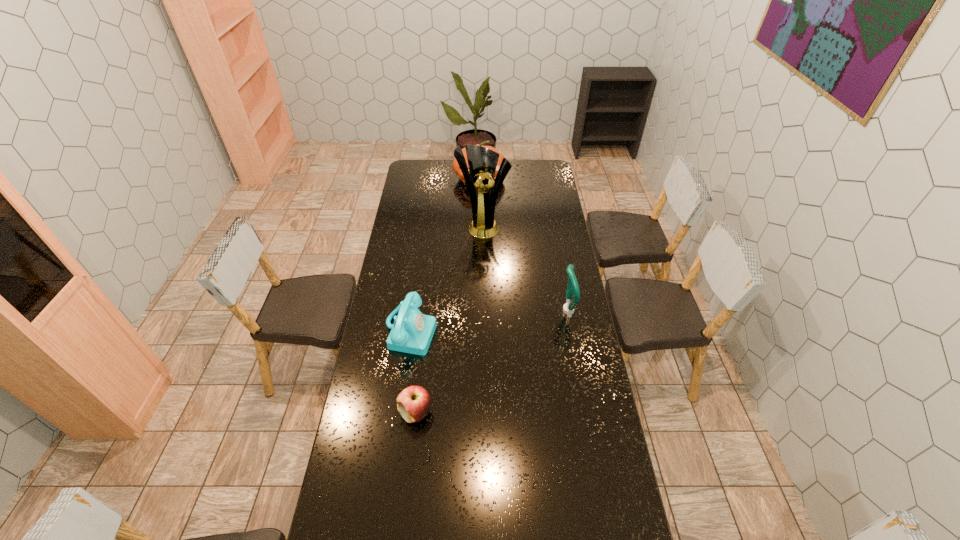
This screenshot has width=960, height=540. What are the coordinates of `vacant space located 0.080m on the front face of the pumpkin` in the screenshot? It's located at [484, 201].

At what (x,y) coordinates should I click in order to perform the action: click on vacant position located on the front face of the pumpkin. Please return your answer as a coordinate pair (x, y). Looking at the image, I should click on (486, 215).

Find the location of a particular element. The width and height of the screenshot is (960, 540). object that is at the far edge is located at coordinates (455, 165).

The height and width of the screenshot is (540, 960). What are the coordinates of `apple positioned at the left edge` in the screenshot? It's located at (413, 403).

The image size is (960, 540). I want to click on telephone that is at the left edge, so click(412, 332).

Identify the location of object present at the right edge. (572, 287).

Where is `vacant region at the near edge of the desktop`? The width and height of the screenshot is (960, 540). vacant region at the near edge of the desktop is located at coordinates (510, 503).

Where is `free space at the left edge of the desktop`? This screenshot has height=540, width=960. free space at the left edge of the desktop is located at coordinates (419, 186).

Locate an element on the screen. The height and width of the screenshot is (540, 960). vacant space at the right edge of the desktop is located at coordinates (569, 376).

The width and height of the screenshot is (960, 540). What are the coordinates of `blank space at the near right corner of the desktop` in the screenshot? It's located at (576, 508).